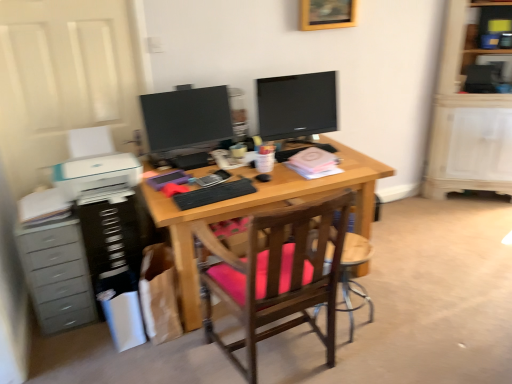
Where is `vacant space in front of gray plastic chest of drawers at left`? The height and width of the screenshot is (384, 512). vacant space in front of gray plastic chest of drawers at left is located at coordinates (67, 355).